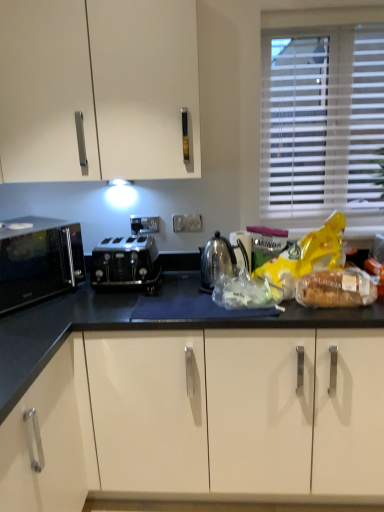
Question: From the image's perspective, relative to satin silver toaster at center, is clear plastic bread at right above or below?

Choices:
 (A) above
 (B) below

Answer: (B)

Question: Is point (304, 278) closer or farther from the camera than point (122, 243)?

Choices:
 (A) closer
 (B) farther

Answer: (A)

Question: Considering the real-world distances, which object is closest to the white blinds at upper right?

Choices:
 (A) brown textured bread at right, marked as the 1th food in a right-to-left arrangement
 (B) translucent plastic bag at center, which is counted as the second food, starting from the right
 (C) satin silver kettle at center
 (D) satin silver toaster at center
 (E) black matte microwave at left

Answer: (A)

Question: Considering the real-world distances, which object is closest to the clear plastic bread at right?

Choices:
 (A) white blinds at upper right
 (B) black matte microwave at left
 (C) satin silver toaster at center
 (D) brown textured bread at right, which appears as the second food when viewed from the left
 (E) satin silver kettle at center

Answer: (D)